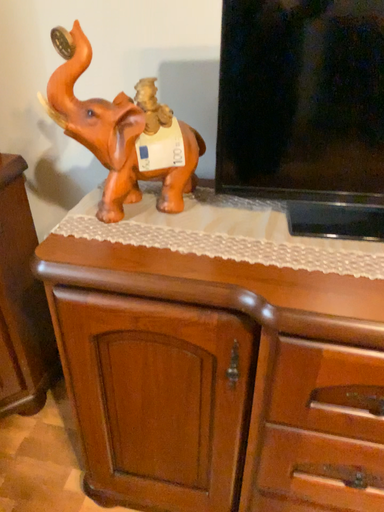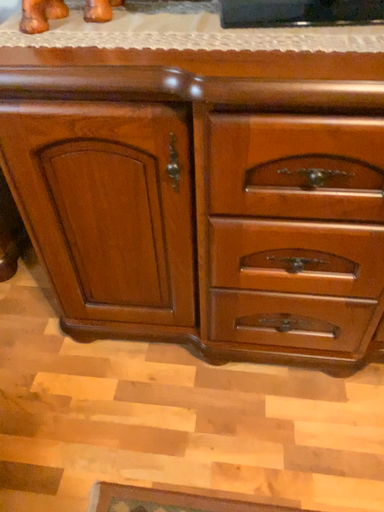
Question: Which way did the camera rotate in the video?

Choices:
 (A) rotated downward
 (B) rotated upward

Answer: (A)